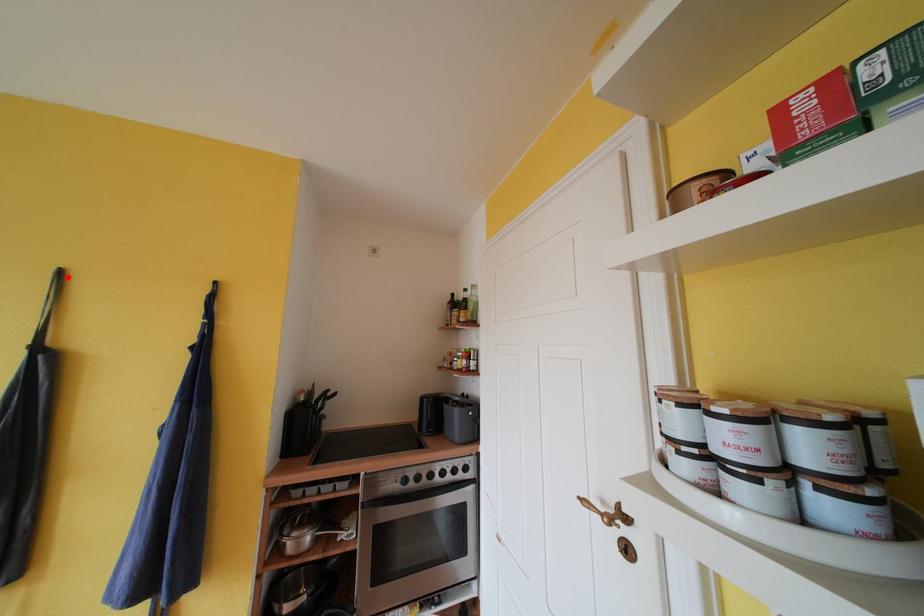
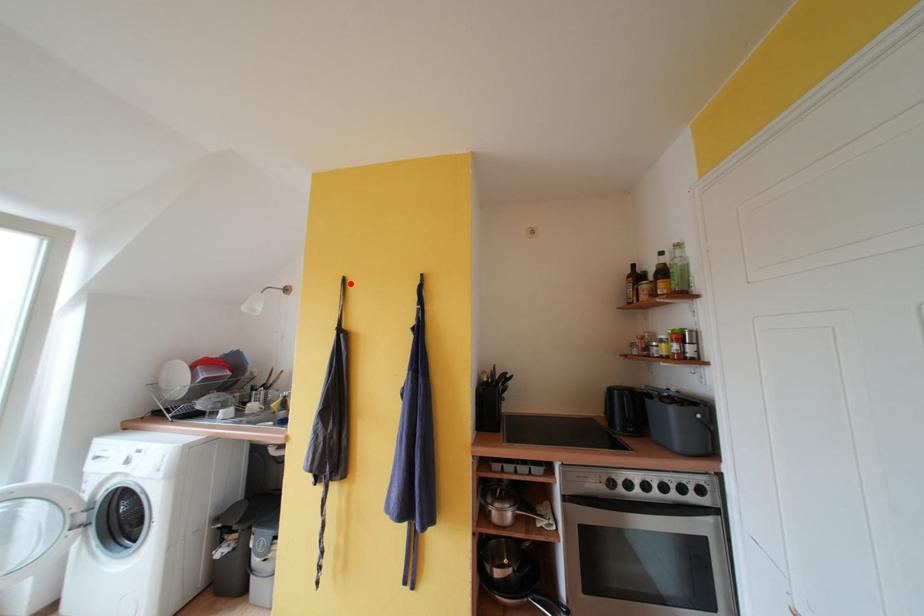
I am providing you with two images of the same scene from different viewpoints. A red point is marked on the first image and another point is marked on the second image. Is the marked point in image1 the same physical position as the marked point in image2?

Yes